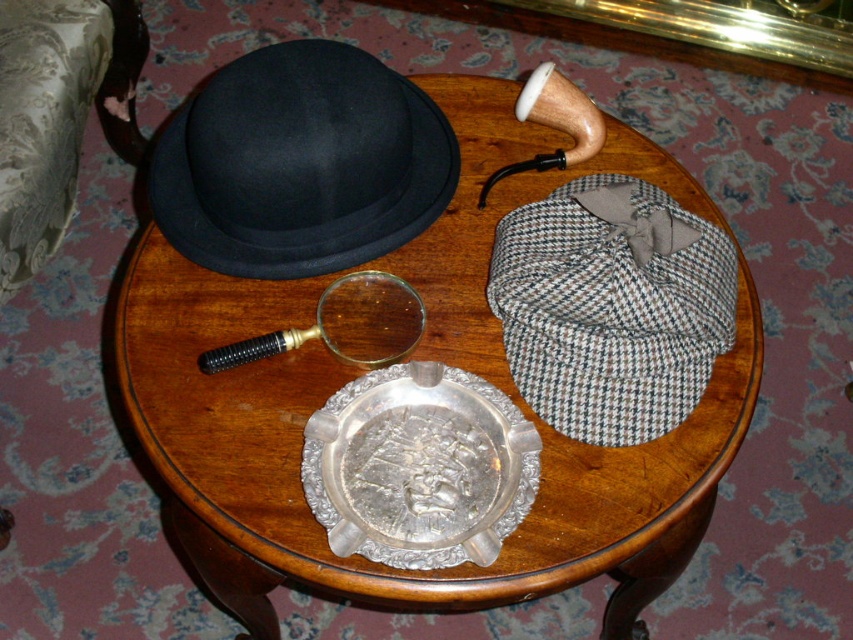
Is point (549, 586) closer to viewer compared to point (312, 253)?

Yes, it is.

Does point (297, 364) come in front of point (305, 232)?

No.

This screenshot has height=640, width=853. Find the location of `wooden round table at center`. wooden round table at center is located at coordinates (415, 358).

Is silver metallic tray at center to the left of gold-toned glass magnifying glass at center from the viewer's perspective?

Incorrect, silver metallic tray at center is not on the left side of gold-toned glass magnifying glass at center.

Does point (318, 472) come in front of point (274, 339)?

Yes, it is in front of point (274, 339).

I want to click on silver metallic tray at center, so click(419, 468).

Is houndstooth wool cap at upper right above silver metallic tray at center?

Correct, houndstooth wool cap at upper right is located above silver metallic tray at center.

Between point (583, 400) and point (366, 433), which one is positioned in front?

Positioned in front is point (583, 400).

Describe the element at coordinates (611, 307) in the screenshot. This screenshot has height=640, width=853. I see `houndstooth wool cap at upper right` at that location.

The image size is (853, 640). Find the location of `houndstooth wool cap at upper right`. houndstooth wool cap at upper right is located at coordinates (611, 307).